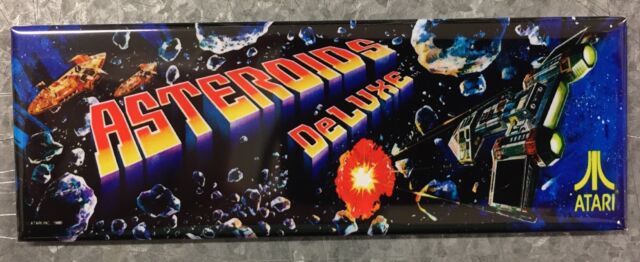
Where is `1 gray marble background`? The image size is (640, 262). 1 gray marble background is located at coordinates (617, 252).